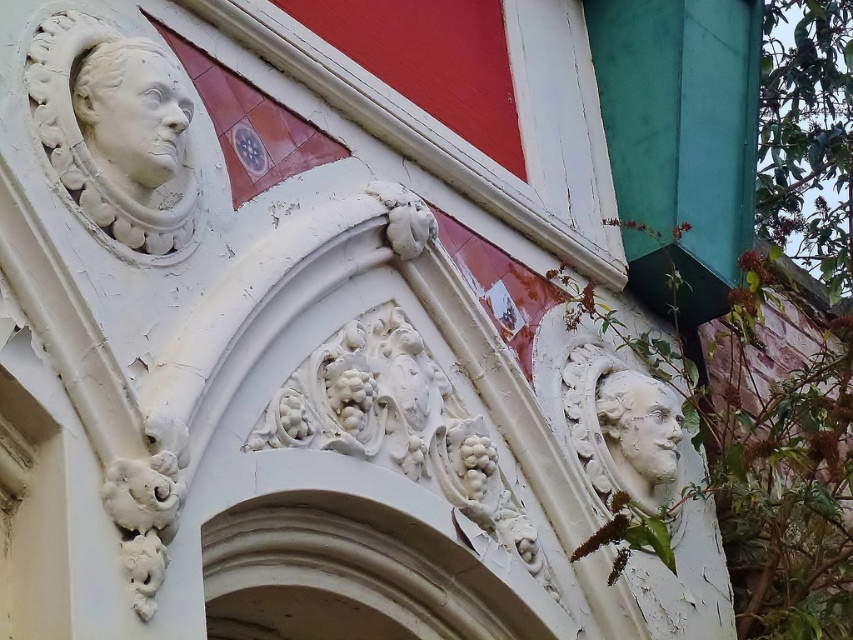
You are an art conservator examining the ornate architectural detail. You notice two faces carved into the stone facade. The first is the white plaster face at upper left, and the second is the white stone face at lower right. Which face is closer to the viewer?

The white plaster face at upper left is closer to the viewer because it is in front of the white stone face at lower right.

In the scene shown: You are an art conservator examining the architectural detail. You notice two faces carved into the stone facade. Which face is located to the left of the other? The faces are labeled as the white plaster face at upper left and the white stone face at lower right. Please specify which one is on the left side.

The white plaster face at upper left is positioned on the left side of the white stone face at lower right.